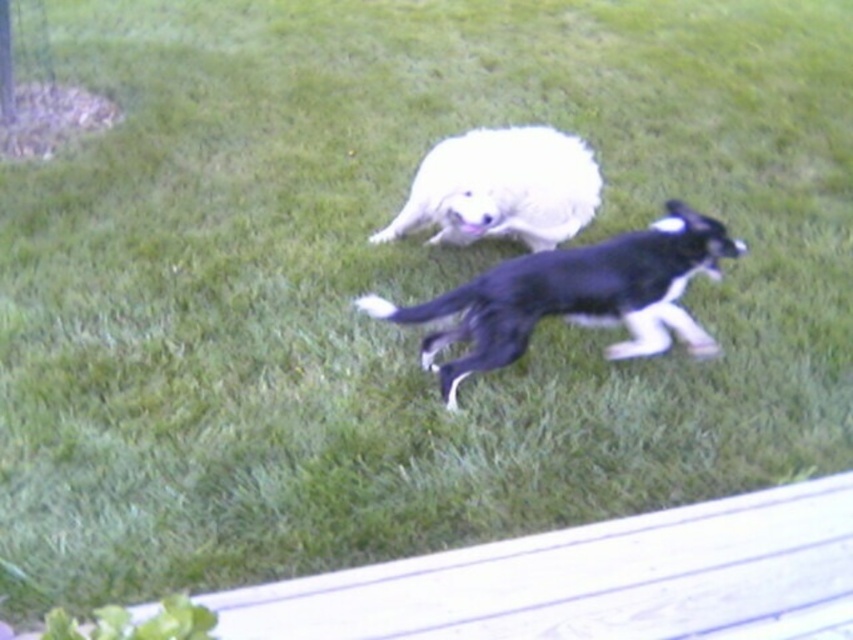
You are a photographer trying to capture both dogs in a single shot. Since the black matte dog at center is moving towards you while the white fluffy dog at center is stationary, which dog should you focus on to ensure both are in focus?

You should focus on the black matte dog at center because it is in front of the white fluffy dog at center, so focusing on the closer subject will keep both in focus due to the depth of field.

You are standing at the point with coordinates point (575, 296). Looking around, you see a black matte dog at center. Which direction should you walk to find the other dog in the image?

The black matte dog at center is located at point (575, 296). To find the other dog, you should walk away from the black matte dog at center towards the background where the white dog is lying on the grass.

You are standing 10 feet away from the camera. You want to throw a ball to the black matte dog at center. Can you reach the dog with your throw?

The black matte dog at center is 8.35 feet away from the camera. Since you are 10 feet away from the camera, the distance between you and the dog is approximately 1.65 feet. Yes, you can easily reach the dog with your throw.